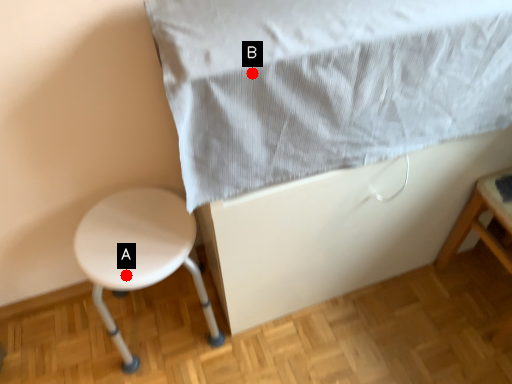
Question: Two points are circled on the image, labeled by A and B beside each circle. Which of the following is the farthest from the observer?

Choices:
 (A) A is further
 (B) B is further

Answer: (A)